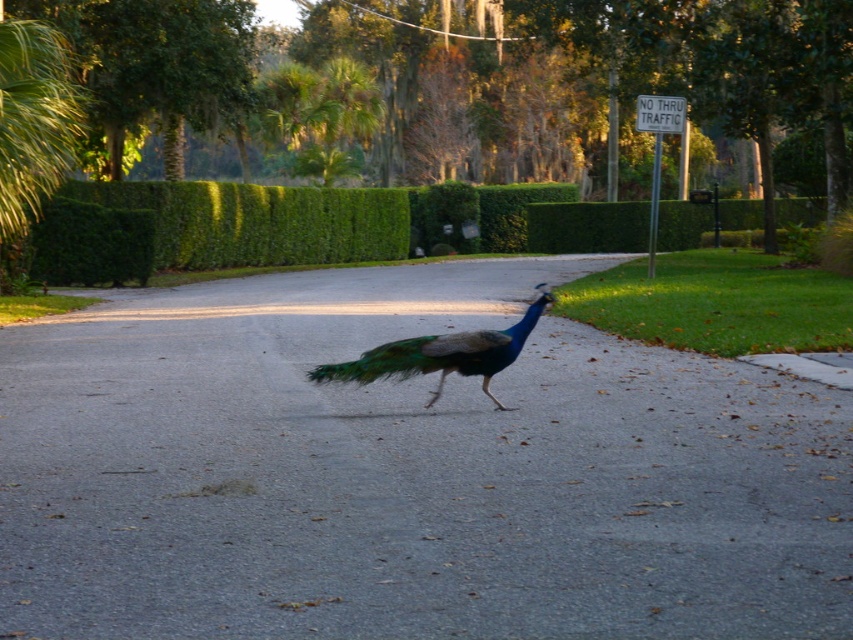
Question: Which object appears farthest from the camera in this image?

Choices:
 (A) green iridescent tail at center
 (B) shiny blue peacock at center
 (C) green leafy hedge at center
 (D) shiny asphalt road at center

Answer: (C)

Question: Among these objects, which one is farthest from the camera?

Choices:
 (A) green leafy hedge at center
 (B) shiny blue peacock at center
 (C) shiny asphalt road at center
 (D) green iridescent tail at center

Answer: (A)

Question: Considering the real-world distances, which object is farthest from the green leafy hedge at center?

Choices:
 (A) shiny asphalt road at center
 (B) shiny blue peacock at center

Answer: (B)

Question: Considering the relative positions of shiny asphalt road at center and shiny blue peacock at center in the image provided, where is shiny asphalt road at center located with respect to shiny blue peacock at center?

Choices:
 (A) below
 (B) above

Answer: (A)

Question: Does shiny asphalt road at center appear on the right side of green iridescent tail at center?

Choices:
 (A) no
 (B) yes

Answer: (A)

Question: Can you confirm if shiny asphalt road at center is bigger than green leafy hedge at center?

Choices:
 (A) yes
 (B) no

Answer: (B)